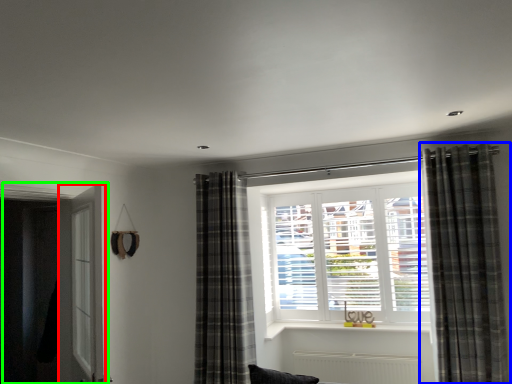
Question: Estimate the real-world distances between objects in this image. Which object is farther from screen door (highlighted by a red box), curtain (highlighted by a blue box) or door (highlighted by a green box)?

Choices:
 (A) curtain
 (B) door

Answer: (A)